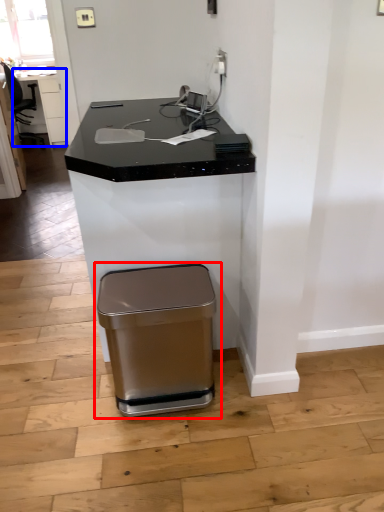
Question: Which of the following is the farthest to the observer, waste container (highlighted by a red box) or table (highlighted by a blue box)?

Choices:
 (A) waste container
 (B) table

Answer: (B)